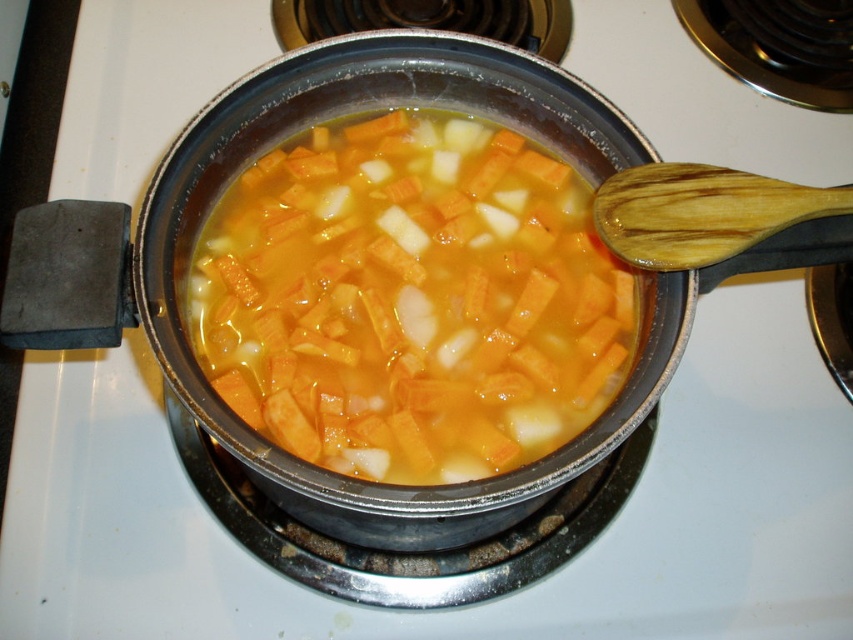
Question: Does orange matte/soft pumpkin soup at center appear on the right side of wooden spoon at upper right?

Choices:
 (A) no
 (B) yes

Answer: (A)

Question: Is orange matte/soft pumpkin soup at center thinner than wooden spoon at upper right?

Choices:
 (A) yes
 (B) no

Answer: (B)

Question: Does orange matte/soft pumpkin soup at center appear under wooden spoon at upper right?

Choices:
 (A) no
 (B) yes

Answer: (B)

Question: Which point is farther from the camera taking this photo?

Choices:
 (A) (206, 323)
 (B) (685, 225)

Answer: (A)

Question: Which point is farther to the camera?

Choices:
 (A) orange matte/soft pumpkin soup at center
 (B) wooden spoon at upper right

Answer: (A)

Question: Among these points, which one is nearest to the camera?

Choices:
 (A) (517, 456)
 (B) (718, 211)

Answer: (B)